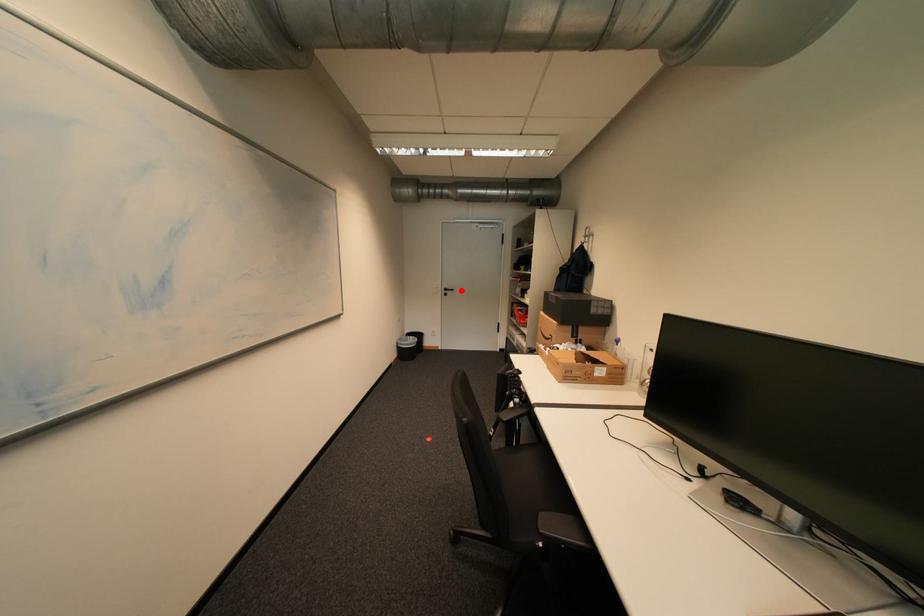
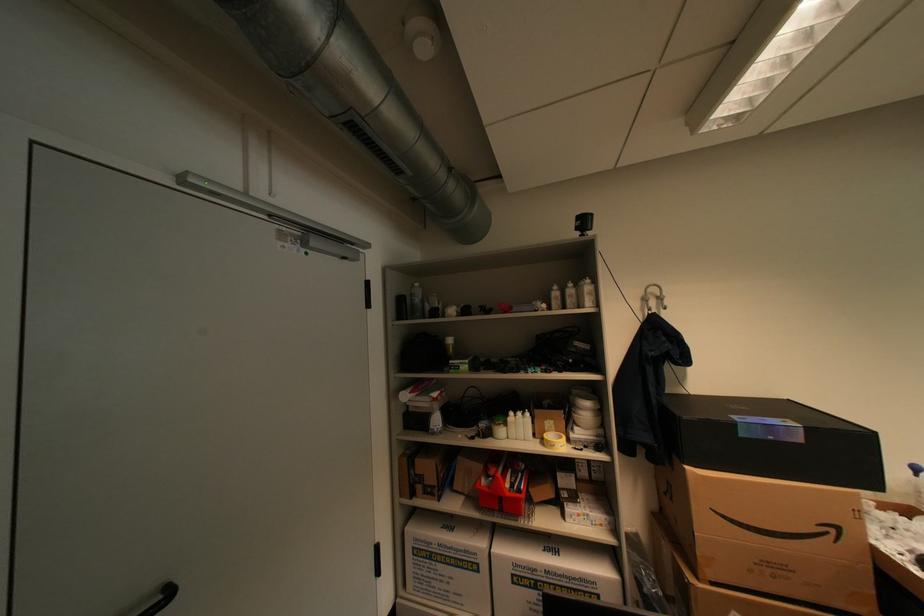
Where in the second image is the point corresponding to the highlighted location from the first image?

(176, 594)